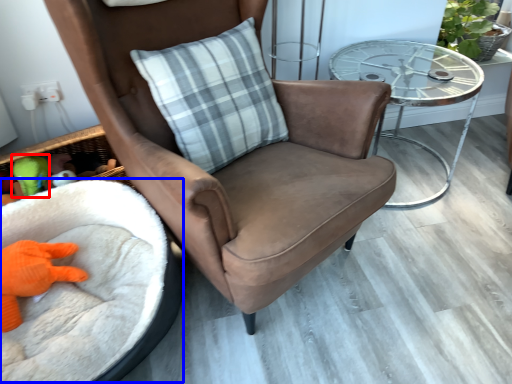
Question: Which point is further to the camera, toy (highlighted by a red box) or infant bed (highlighted by a blue box)?

Choices:
 (A) toy
 (B) infant bed

Answer: (A)